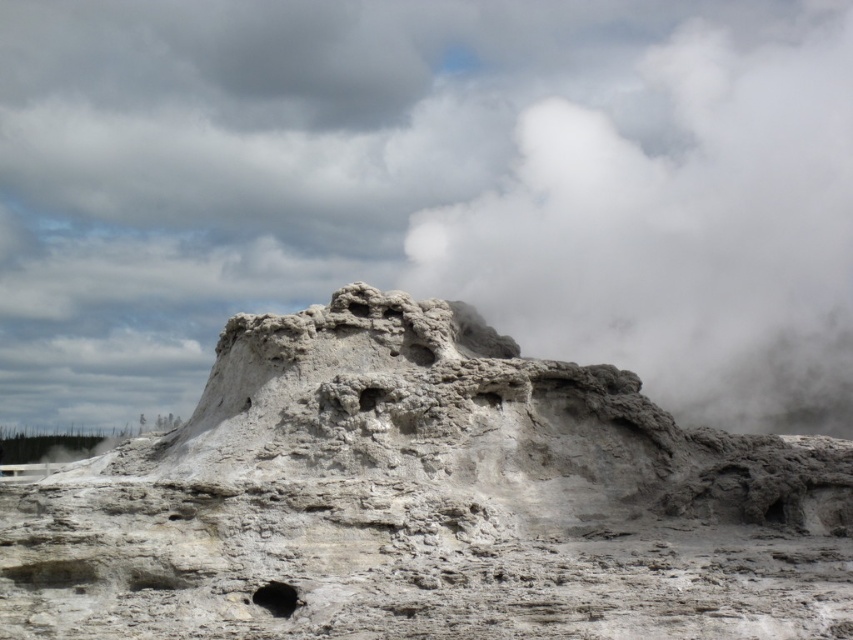
Question: Among these points, which one is nearest to the camera?

Choices:
 (A) (279, 611)
 (B) (502, 358)
 (C) (616, 113)

Answer: (A)

Question: Is gray stone rock formation at center to the right of black matte hole at lower center from the viewer's perspective?

Choices:
 (A) yes
 (B) no

Answer: (A)

Question: Can you confirm if white fluffy cloud at upper center is positioned below black matte hole at lower center?

Choices:
 (A) no
 (B) yes

Answer: (A)

Question: Estimate the real-world distances between objects in this image. Which object is farther from the black matte hole at lower center?

Choices:
 (A) white fluffy cloud at upper center
 (B) gray stone rock formation at center

Answer: (A)

Question: Which point appears farthest from the camera in this image?

Choices:
 (A) (x=630, y=588)
 (B) (x=285, y=602)
 (C) (x=850, y=280)

Answer: (C)

Question: Observing the image, what is the correct spatial positioning of gray stone rock formation at center in reference to black matte hole at lower center?

Choices:
 (A) above
 (B) below

Answer: (A)